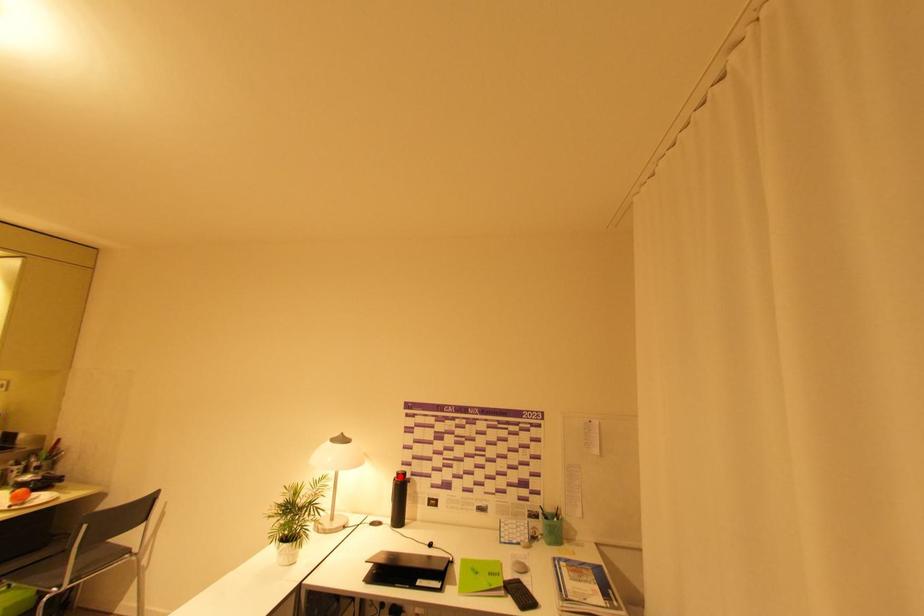
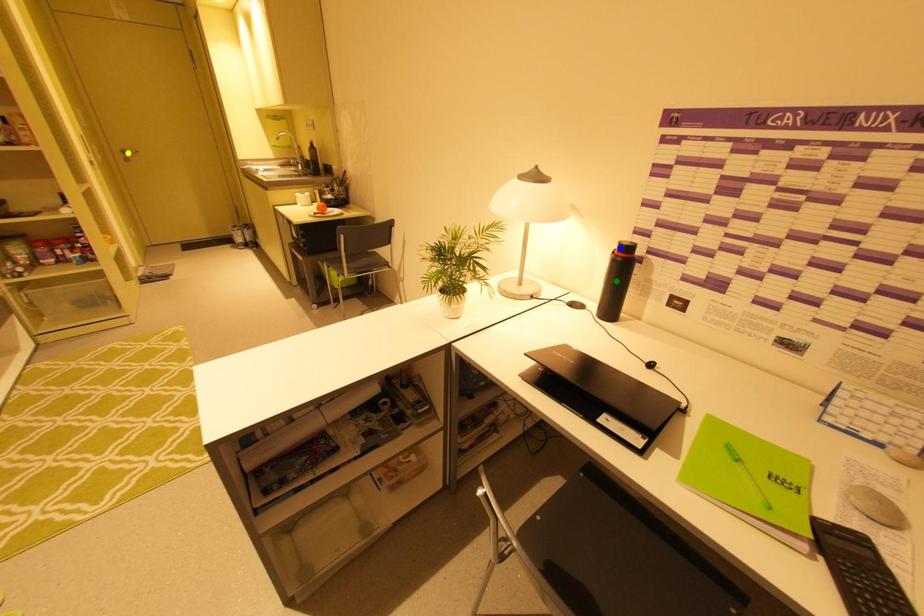
Question: I am providing you with two images of the same scene from different viewpoints. A red point is marked on the first image. You are given multiple points on the second image. Can you choose the point in image 2 that corresponds to the point in image 1?

Choices:
 (A) blue point
 (B) green point
 (C) yellow point

Answer: (A)